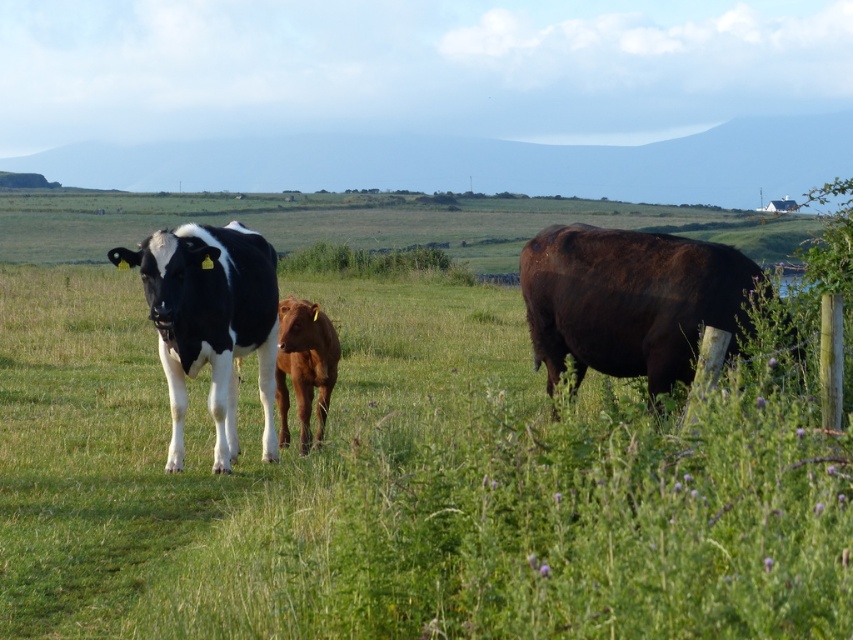
Question: Which of the following is the farthest from the observer?

Choices:
 (A) (299, 429)
 (B) (541, 540)
 (C) (256, 246)

Answer: (A)

Question: Can you confirm if green grass at center is bigger than shiny dark brown bull at right?

Choices:
 (A) yes
 (B) no

Answer: (A)

Question: Based on their relative distances, which object is nearer to the black and white cow at left?

Choices:
 (A) green grass at center
 (B) shiny dark brown bull at right

Answer: (A)

Question: Can you confirm if shiny dark brown bull at right is smaller than brown smooth calf at center?

Choices:
 (A) yes
 (B) no

Answer: (B)

Question: Which object appears farthest from the camera in this image?

Choices:
 (A) green grass at center
 (B) black and white cow at left

Answer: (B)

Question: Can you confirm if green grass at center is thinner than shiny dark brown bull at right?

Choices:
 (A) yes
 (B) no

Answer: (B)